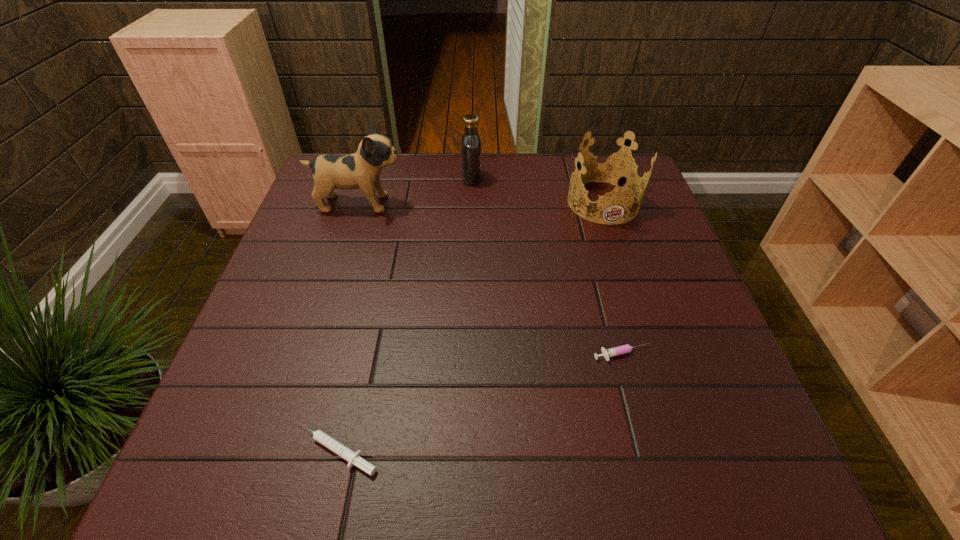
In order to click on free spot between the tallest object and the right syringe in this screenshot , I will do `click(491, 279)`.

In order to click on free spot between the vodka and the nearest object in this screenshot , I will do `click(404, 314)`.

Identify the location of free spot between the nearest object and the second nearest object. (479, 402).

At what (x,y) coordinates should I click in order to perform the action: click on free space between the puppy and the crown. Please return your answer as a coordinate pair (x, y). Image resolution: width=960 pixels, height=540 pixels. Looking at the image, I should click on (481, 202).

Locate which object is the second closest to the vodka. Please provide its 2D coordinates. Your answer should be formatted as a tuple, i.e. [(x, y)], where the tuple contains the x and y coordinates of a point satisfying the conditions above.

[(612, 167)]

You are a GUI agent. You are given a task and a screenshot of the screen. Output one action in this format:
    pyautogui.click(x=<x>, y=<y>)
    Task: Click on the object identified as the second closest to the farther syringe
    
    Given the screenshot: What is the action you would take?
    pyautogui.click(x=353, y=458)

Identify the location of vacant space that satisfies the following two spatial constraints: 1. on the front-facing side of the right syringe; 2. on the right side of the third object from right to left. This screenshot has height=540, width=960. (468, 355).

The height and width of the screenshot is (540, 960). What are the coordinates of `free location that satisfies the following two spatial constraints: 1. on the back side of the crown; 2. on the left side of the fourth farthest object` in the screenshot? It's located at (582, 202).

Where is `free spot that satisfies the following two spatial constraints: 1. on the front-facing side of the crown; 2. on the left side of the third object from right to left`? free spot that satisfies the following two spatial constraints: 1. on the front-facing side of the crown; 2. on the left side of the third object from right to left is located at coordinates (471, 202).

You are a GUI agent. You are given a task and a screenshot of the screen. Output one action in this format:
    pyautogui.click(x=<x>, y=<y>)
    Task: Click on the blank area in the image that satisfies the following two spatial constraints: 1. at the face of the fourth farthest object; 2. on the right side of the puppy
    The image size is (960, 540).
    Given the screenshot: What is the action you would take?
    pyautogui.click(x=311, y=355)